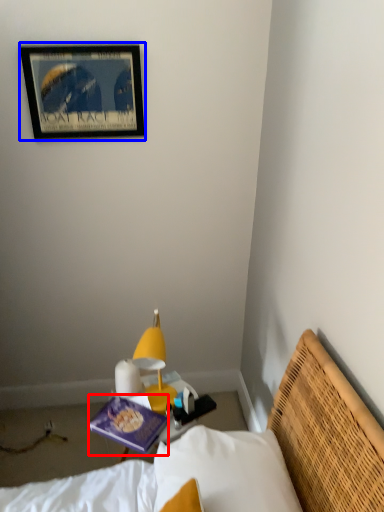
Question: Among these objects, which one is nearest to the camera, book (highlighted by a red box) or picture frame (highlighted by a blue box)?

Choices:
 (A) book
 (B) picture frame

Answer: (A)